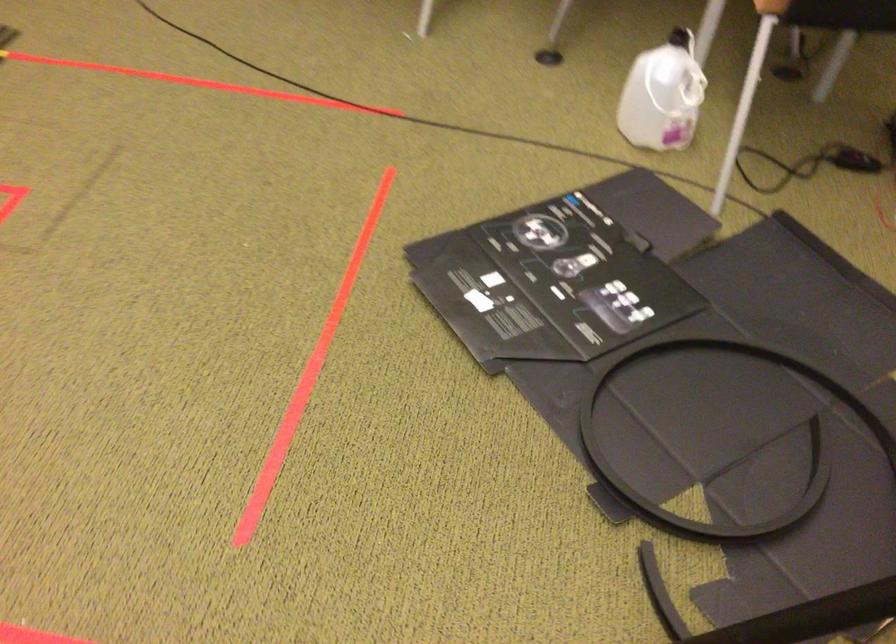
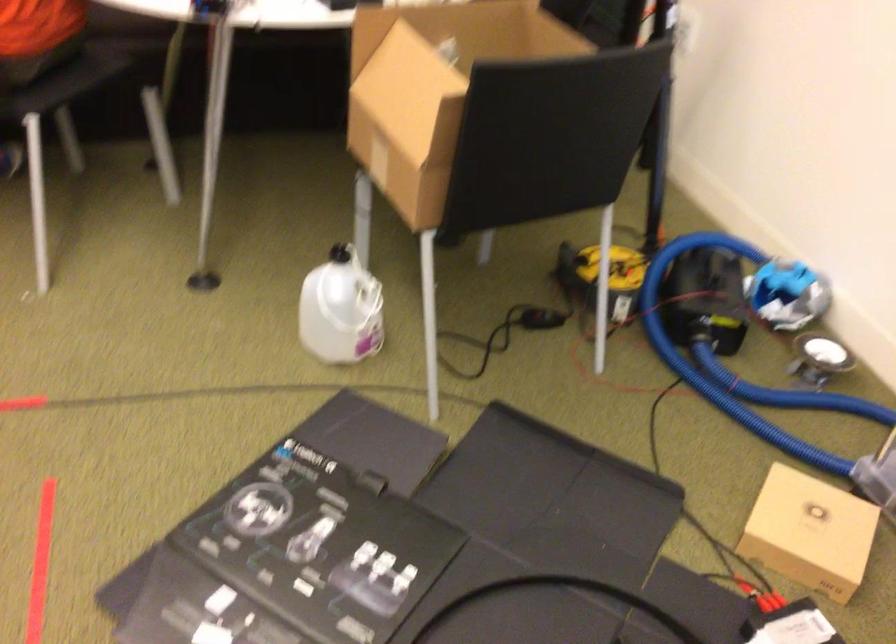
Locate, in the second image, the point that corresponds to point 772,373 in the first image.

(556, 601)